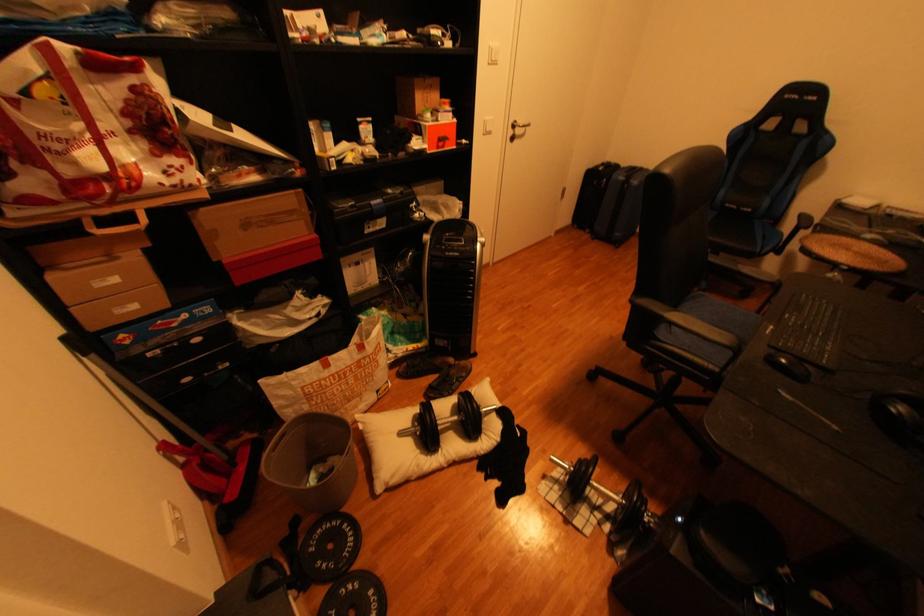
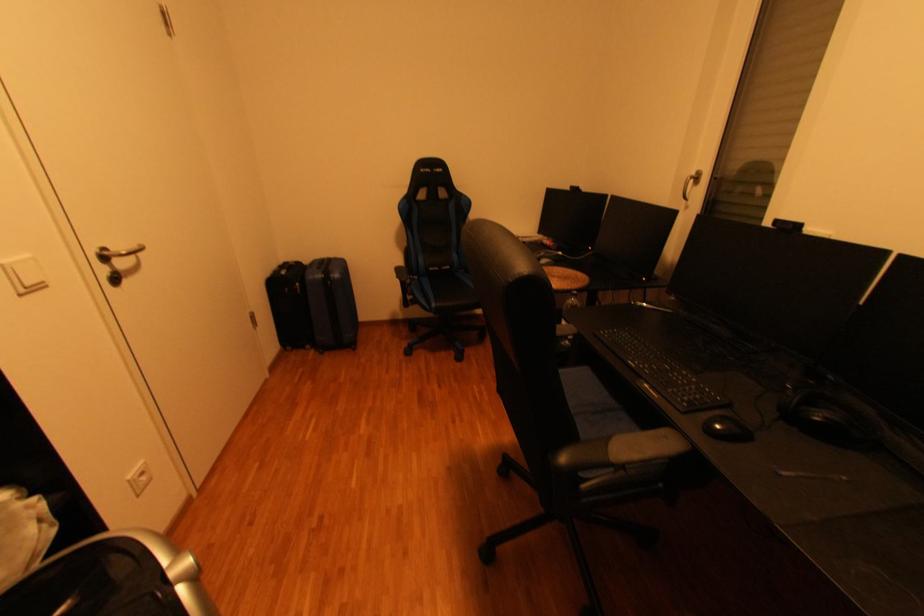
Question: The images are taken continuously from a first-person perspective. In which direction is your viewpoint rotating?

Choices:
 (A) Left
 (B) Right
 (C) Up
 (D) Down

Answer: (B)